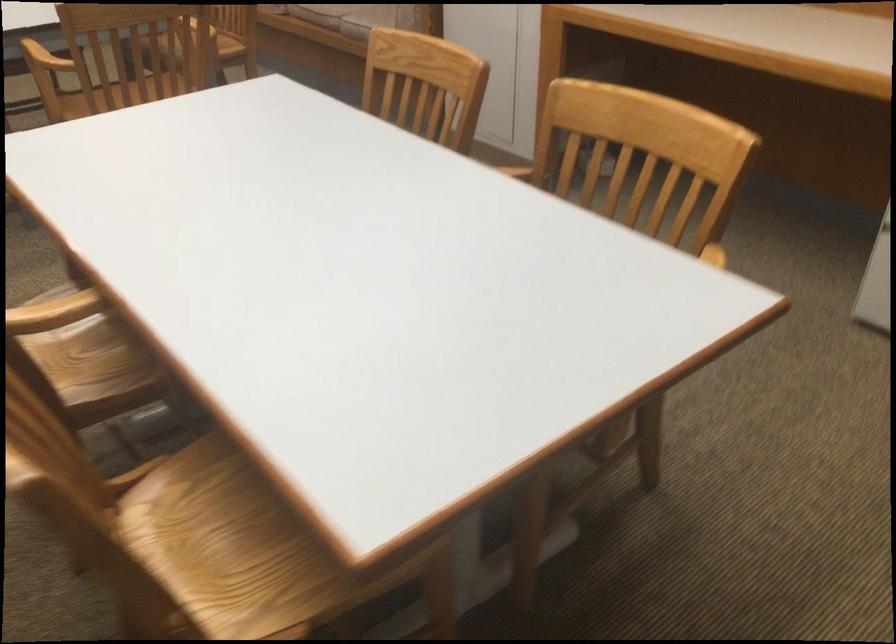
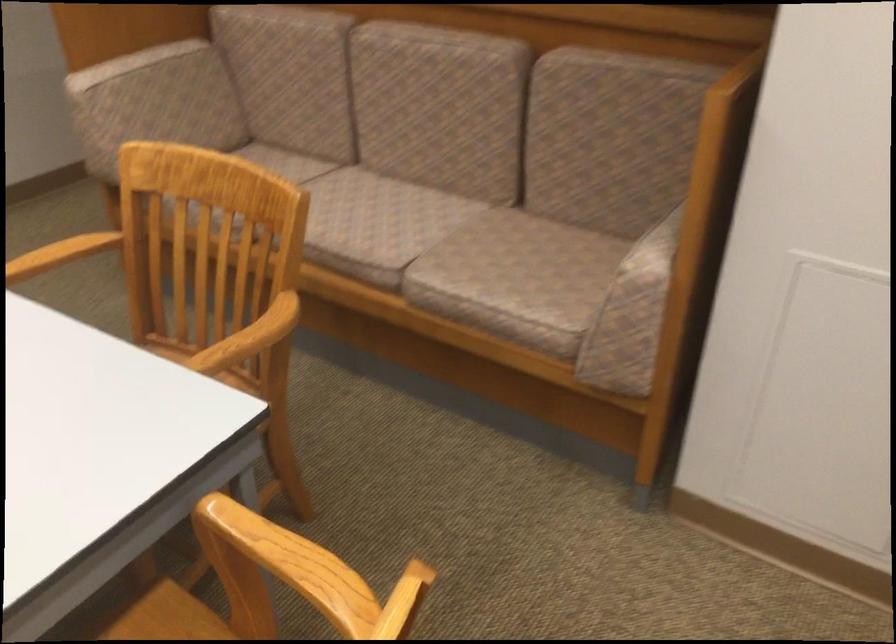
In a continuous first-person perspective shot, in which direction is the camera moving?

The movement direction of the cameraman is left, forward.